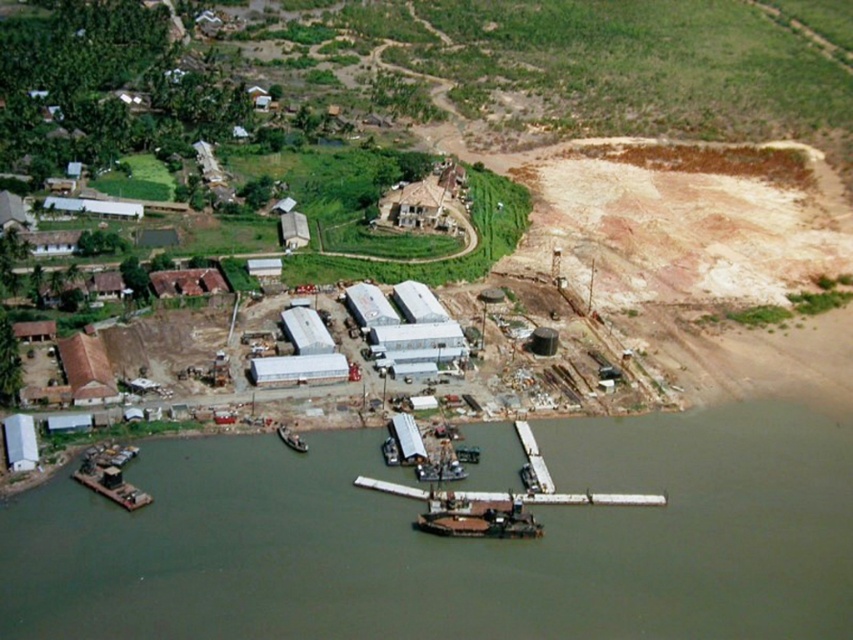
You are a delivery drone with a wingspan of 2 meters. You need to fly between the white matte dock at lower center and the wooden dock at lower center. Can you safely pass through the space between them without touching either dock?

The distance between the white matte dock at lower center and the wooden dock at lower center is 8.30 meters. Since your wingspan is 2 meters, you can safely pass through the space between them as the distance is more than sufficient to avoid contact with either dock.

You are a crane operator who needs to lift a heavy container from the metallic gray barge at lower center and place it onto the wooden dock at lower center. Based on the scene, will the crane be able to safely lift and transfer the container without any height restrictions?

The metallic gray barge at lower center has a lesser height compared to the wooden dock at lower center. This means the crane can safely lift the container from the barge and place it onto the dock since the dock is taller, allowing sufficient clearance for the operation.